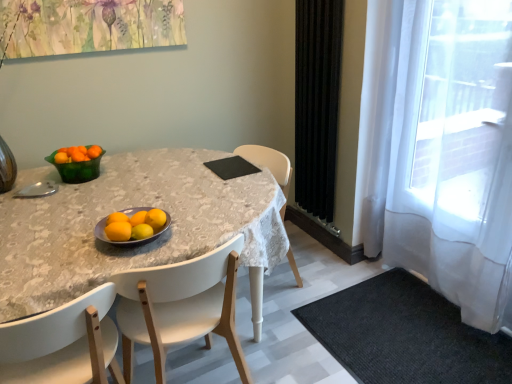
Question: From the image's perspective, is black matte pad at center on orange matte at center, which is the 4th tangerine in back-to-front order?

Choices:
 (A) no
 (B) yes

Answer: (B)

Question: Can you confirm if black matte pad at center is shorter than orange matte at center, the second tangerine when ordered from bottom to top?

Choices:
 (A) yes
 (B) no

Answer: (A)

Question: Can you confirm if black matte pad at center is bigger than orange matte at center, arranged as the fourth tangerine when viewed from the left?

Choices:
 (A) no
 (B) yes

Answer: (B)

Question: Is black matte pad at center positioned with its back to orange matte at center, arranged as the fourth tangerine when viewed from the left?

Choices:
 (A) no
 (B) yes

Answer: (A)

Question: Can you confirm if black matte pad at center is wider than orange matte at center, the second tangerine when ordered from bottom to top?

Choices:
 (A) yes
 (B) no

Answer: (A)

Question: From a real-world perspective, relative to orange matte tangerine at upper left, the first tangerine viewed from the back, is white glossy table at center vertically above or below?

Choices:
 (A) above
 (B) below

Answer: (B)

Question: Is white glossy table at center taller or shorter than orange matte tangerine at upper left, marked as the 3th tangerine in a right-to-left arrangement?

Choices:
 (A) tall
 (B) short

Answer: (A)

Question: Considering the relative positions of white glossy table at center and orange matte tangerine at upper left, which is counted as the fourth tangerine, starting from the bottom, in the image provided, is white glossy table at center to the left or to the right of orange matte tangerine at upper left, which is counted as the fourth tangerine, starting from the bottom,?

Choices:
 (A) right
 (B) left

Answer: (A)

Question: In terms of width, does white glossy table at center look wider or thinner when compared to orange matte tangerine at upper left, the 1th tangerine from the top?

Choices:
 (A) wide
 (B) thin

Answer: (A)

Question: Is point (23, 324) closer or farther from the camera than point (146, 218)?

Choices:
 (A) farther
 (B) closer

Answer: (B)

Question: Is white plastic chair at lower center, which is the 2th chair in right-to-left order, bigger or smaller than orange matte at center, placed as the 1th tangerine when sorted from right to left?

Choices:
 (A) big
 (B) small

Answer: (A)

Question: Is white plastic chair at lower center, which is the 2th chair in right-to-left order, to the left or to the right of orange matte at center, placed as the 1th tangerine when sorted from right to left, in the image?

Choices:
 (A) left
 (B) right

Answer: (A)

Question: From a real-world perspective, is white plastic chair at lower center, which is the 2th chair in right-to-left order, physically located above or below orange matte at center, the second tangerine when ordered from bottom to top?

Choices:
 (A) above
 (B) below

Answer: (B)

Question: Choose the correct answer: Is black textured rug at lower right inside matte gray bowl at center, which ranks as the first bowl in right-to-left order, or outside it?

Choices:
 (A) outside
 (B) inside

Answer: (A)

Question: Looking at the image, does black textured rug at lower right seem bigger or smaller compared to matte gray bowl at center, which ranks as the first bowl in right-to-left order?

Choices:
 (A) small
 (B) big

Answer: (B)